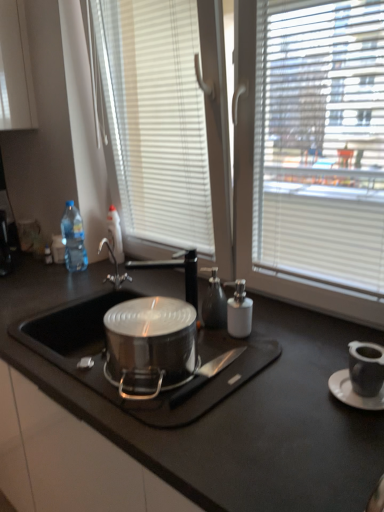
Locate an element on the screen. free space in front of white ceramic saucer at lower right is located at coordinates (350, 444).